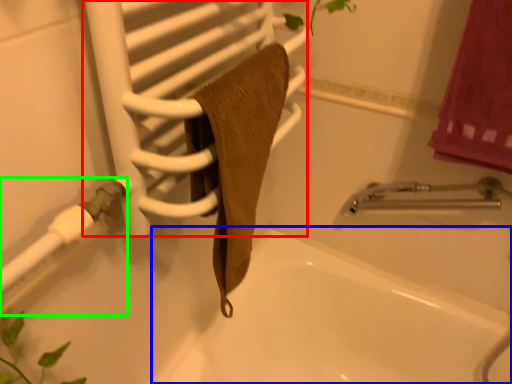
Question: Which object is the closest to the screen door (highlighted by a red box)? Choose among these: bath (highlighted by a blue box) or shower (highlighted by a green box).

Choices:
 (A) bath
 (B) shower

Answer: (B)